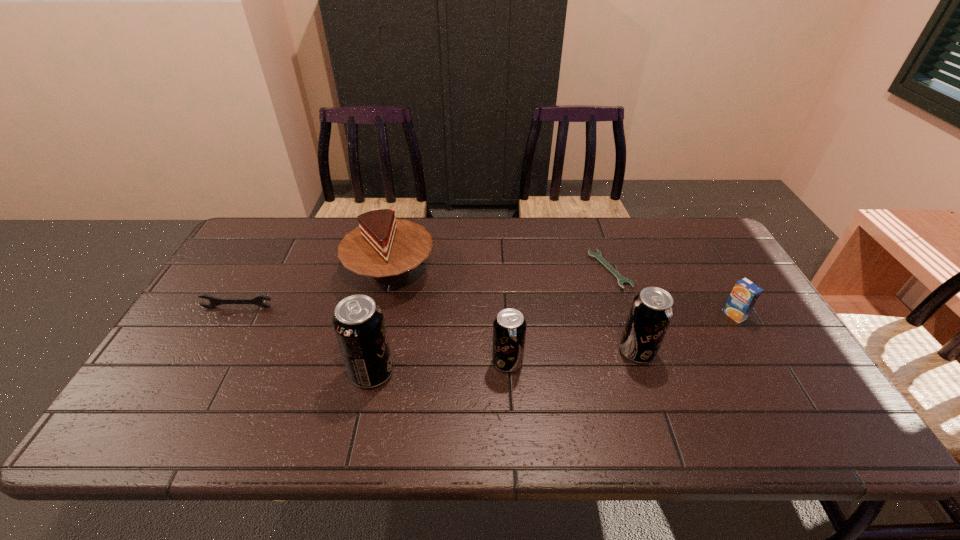
Identify the location of vacant region between the farther wrench and the leftmost soda can. (491, 321).

Where is `free space between the shorter wrench and the leftmost soda can`? The width and height of the screenshot is (960, 540). free space between the shorter wrench and the leftmost soda can is located at coordinates pyautogui.click(x=491, y=321).

The image size is (960, 540). I want to click on free space between the right wrench and the second soda can from right to left, so click(559, 316).

Where is `free space between the second shortest soda can and the fourth object from left to right`? This screenshot has width=960, height=540. free space between the second shortest soda can and the fourth object from left to right is located at coordinates (572, 356).

You are a GUI agent. You are given a task and a screenshot of the screen. Output one action in this format:
    pyautogui.click(x=<x>, y=<y>)
    Task: Click on the free spot between the leftmost soda can and the fifth tallest object
    
    Given the screenshot: What is the action you would take?
    pyautogui.click(x=553, y=344)

This screenshot has width=960, height=540. What are the coordinates of `vacant space that's between the cake and the shorter wrench` in the screenshot? It's located at (500, 271).

The width and height of the screenshot is (960, 540). Find the location of `free space between the leftmost soda can and the orange_juice`. free space between the leftmost soda can and the orange_juice is located at coordinates (553, 344).

Locate an element on the screen. the second closest object to the shortest object is located at coordinates (745, 294).

You are a GUI agent. You are given a task and a screenshot of the screen. Output one action in this format:
    pyautogui.click(x=<x>, y=<y>)
    Task: Click on the object that is the fourth closest to the cake
    
    Given the screenshot: What is the action you would take?
    pyautogui.click(x=621, y=280)

At what (x,y) coordinates should I click in order to perform the action: click on soda can identified as the second closest to the cake. Please return your answer as a coordinate pair (x, y). This screenshot has width=960, height=540. Looking at the image, I should click on (509, 327).